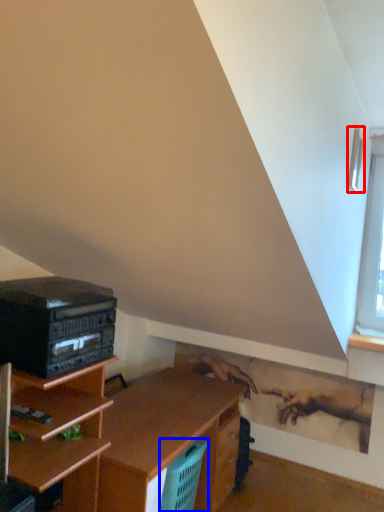
Question: Which of the following is the closest to the observer, window (highlighted by a red box) or basket (highlighted by a blue box)?

Choices:
 (A) window
 (B) basket

Answer: (A)